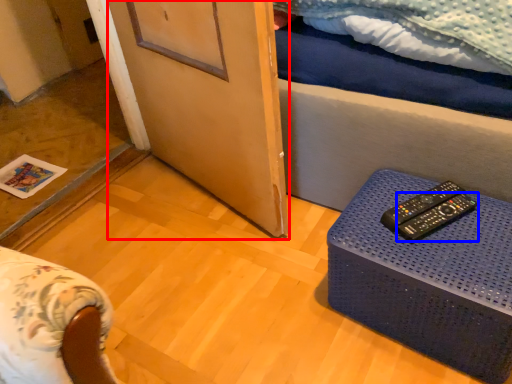
Question: Which object is further to the camera taking this photo, screen door (highlighted by a red box) or remote control (highlighted by a blue box)?

Choices:
 (A) screen door
 (B) remote control

Answer: (B)